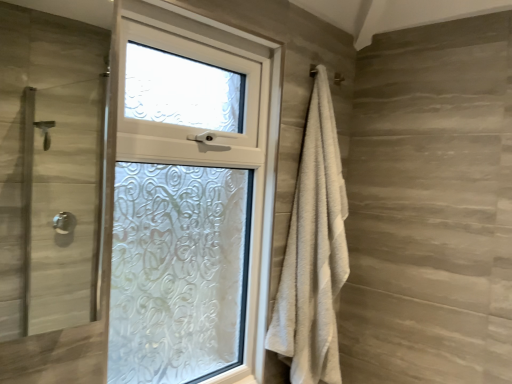
Question: From a real-world perspective, is white textured towel at right on clear glass shower door at left?

Choices:
 (A) no
 (B) yes

Answer: (A)

Question: From a real-world perspective, is white textured towel at right beneath clear glass shower door at left?

Choices:
 (A) no
 (B) yes

Answer: (B)

Question: Is white textured towel at right wider than clear glass shower door at left?

Choices:
 (A) yes
 (B) no

Answer: (A)

Question: Can you confirm if white textured towel at right is thinner than clear glass shower door at left?

Choices:
 (A) yes
 (B) no

Answer: (B)

Question: Is white textured towel at right to the left of clear glass shower door at left from the viewer's perspective?

Choices:
 (A) yes
 (B) no

Answer: (B)

Question: Does white textured towel at right turn towards clear glass shower door at left?

Choices:
 (A) no
 (B) yes

Answer: (A)

Question: Can you confirm if clear glass shower door at left is taller than white textured towel at right?

Choices:
 (A) yes
 (B) no

Answer: (B)

Question: Does clear glass shower door at left lie in front of white textured towel at right?

Choices:
 (A) yes
 (B) no

Answer: (A)

Question: Is clear glass shower door at left in contact with white textured towel at right?

Choices:
 (A) yes
 (B) no

Answer: (B)

Question: Is clear glass shower door at left located outside white textured towel at right?

Choices:
 (A) no
 (B) yes

Answer: (B)

Question: Is the position of clear glass shower door at left more distant than that of white textured towel at right?

Choices:
 (A) yes
 (B) no

Answer: (B)

Question: Is clear glass shower door at left smaller than white textured towel at right?

Choices:
 (A) no
 (B) yes

Answer: (B)

Question: From the image's perspective, is clear glass shower door at left positioned above or below white textured towel at right?

Choices:
 (A) above
 (B) below

Answer: (A)